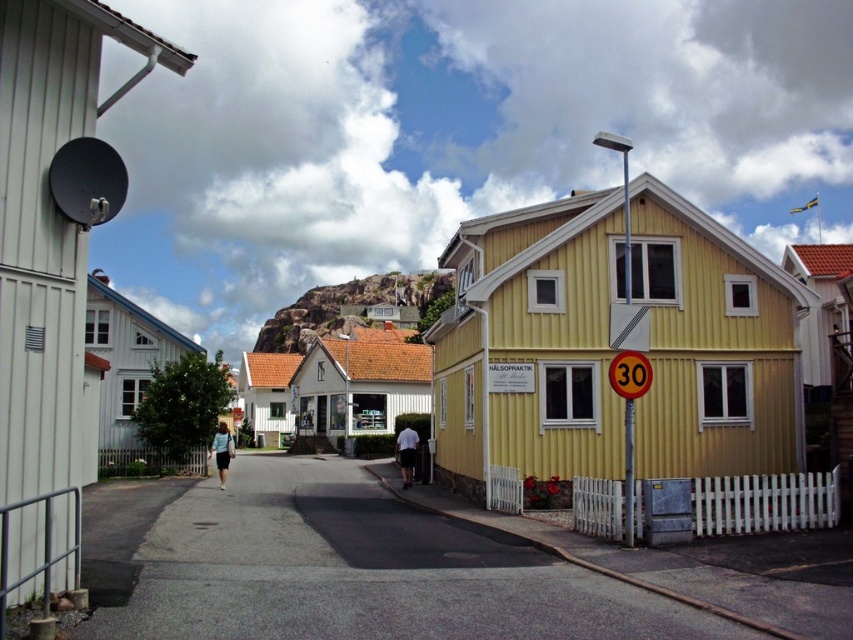
You are a tourist walking down the street and want to take a photo of the white cotton shorts at center without the yellow plastic speed limit sign at right appearing in the frame. Is this possible?

The yellow plastic speed limit sign at right is in front of the white cotton shorts at center, so it will block the view. To take a photo of the white cotton shorts at center without the sign, you would need to move to a position where the sign is no longer between you and the shorts.

Based on the photo, you are a pedestrian standing on the road in the quaint coastal town. You see the yellow plastic speed limit sign at right and the white cotton shorts at center. Which object is positioned higher relative to the ground?

The yellow plastic speed limit sign at right is located above the white cotton shorts at center, so the yellow plastic speed limit sign at right is positioned higher relative to the ground.